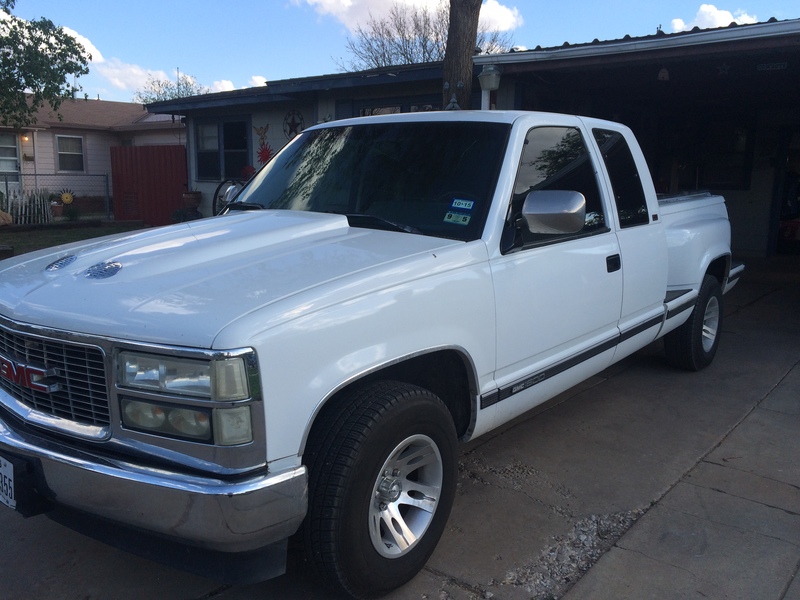
The image size is (800, 600). In order to click on handle in this screenshot , I will do `click(616, 260)`.